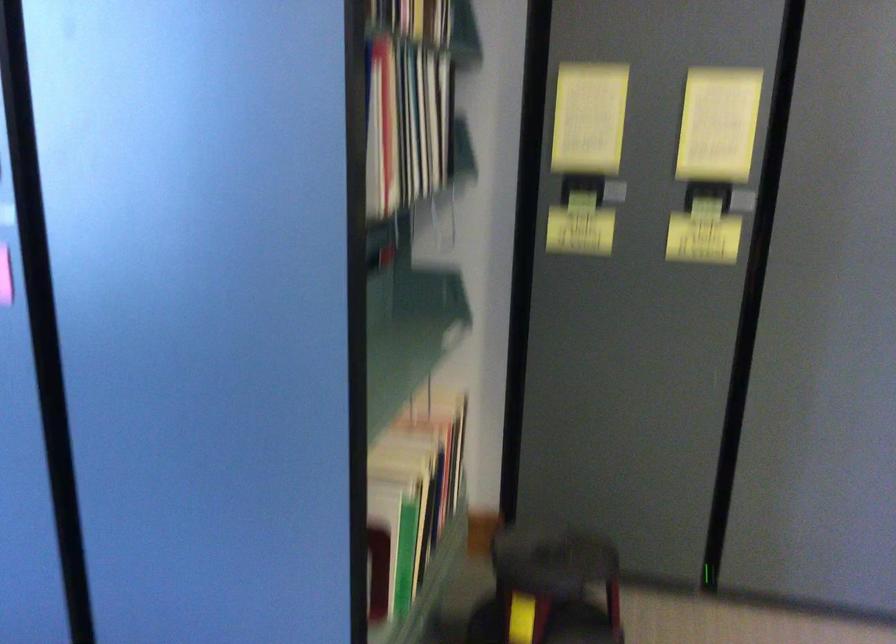
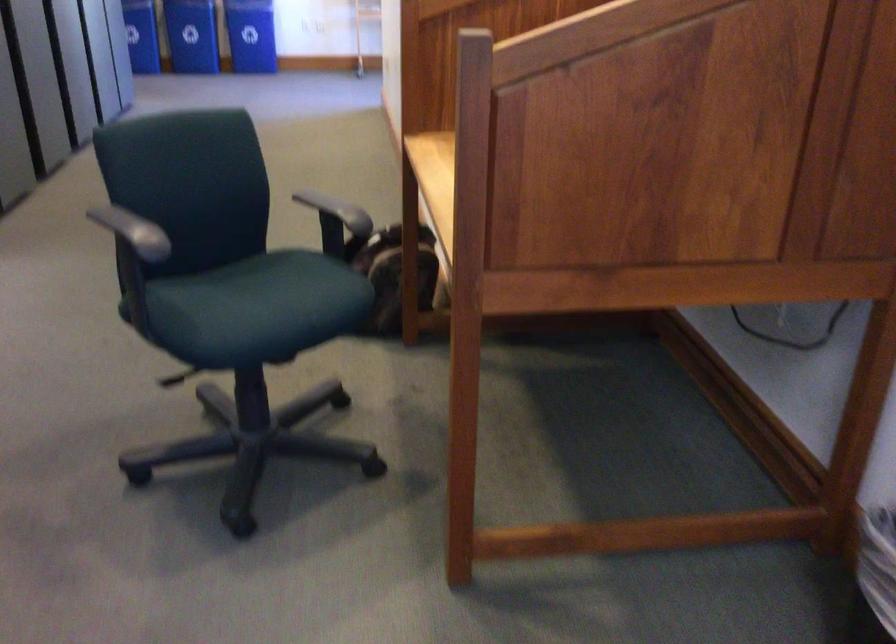
First-person continuous shooting, in which direction is the camera rotating?

The camera's rotation is toward right-down.